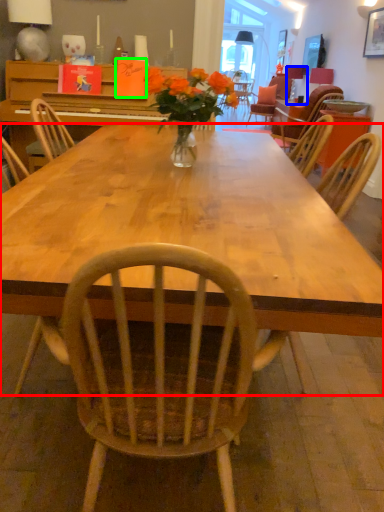
Question: Estimate the real-world distances between objects in this image. Which object is farther from desk (highlighted by a red box), lamp (highlighted by a blue box) or book (highlighted by a green box)?

Choices:
 (A) lamp
 (B) book

Answer: (A)